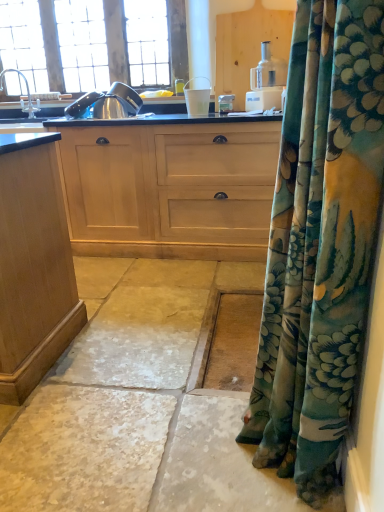
Question: In the image, is white plastic food processor at upper center positioned in front of or behind wooden window at upper left?

Choices:
 (A) behind
 (B) front

Answer: (B)

Question: From the image's perspective, is white plastic food processor at upper center positioned above or below wooden window at upper left?

Choices:
 (A) below
 (B) above

Answer: (A)

Question: Considering the real-world distances, which object is farthest from the white plastic cup at center?

Choices:
 (A) white plastic food processor at upper center
 (B) white stone floor at lower center
 (C) satin nickel faucet at upper left
 (D) wooden window at upper left
 (E) light wood cabinet at center

Answer: (B)

Question: Which of these objects is positioned closest to the white plastic cup at center?

Choices:
 (A) light wood cabinet at center
 (B) wooden window at upper left
 (C) satin nickel faucet at upper left
 (D) white plastic food processor at upper center
 (E) white stone floor at lower center

Answer: (D)